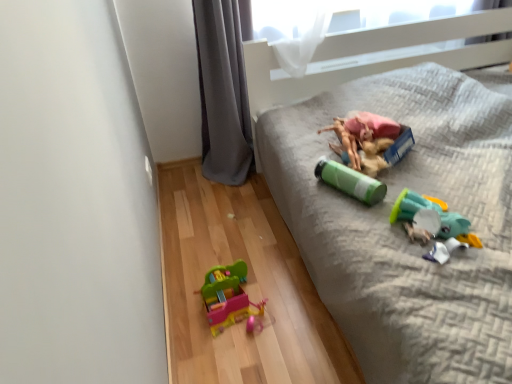
Image resolution: width=512 pixels, height=384 pixels. Identify the location of free area behind multicolored plastic toy at lower center, marked as the 1th toy in a bottom-to-top arrangement. (232, 254).